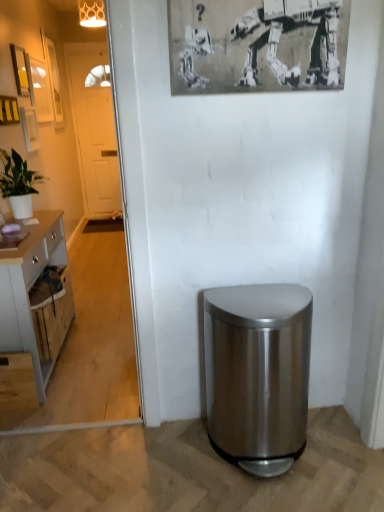
Question: Does wooden picture frame at upper left, positioned as the sixth picture frame in right-to-left order, have a larger size compared to matte white picture frame at upper left, the 3th picture frame from the right?

Choices:
 (A) yes
 (B) no

Answer: (A)

Question: Are wooden picture frame at upper left, marked as the 1th picture frame in a left-to-right arrangement, and matte white picture frame at upper left, positioned as the fourth picture frame in front-to-back order, far apart?

Choices:
 (A) yes
 (B) no

Answer: (A)

Question: Is wooden picture frame at upper left, which is the 6th picture frame from front to back, positioned in front of matte white picture frame at upper left, which is counted as the 3th picture frame, starting from the back?

Choices:
 (A) no
 (B) yes

Answer: (A)

Question: Does wooden picture frame at upper left, positioned as the sixth picture frame in right-to-left order, lie behind matte white picture frame at upper left, the 3th picture frame from the right?

Choices:
 (A) no
 (B) yes

Answer: (B)

Question: From a real-world perspective, does wooden picture frame at upper left, acting as the 1th picture frame starting from the back, stand above matte white picture frame at upper left, the 3th picture frame from the right?

Choices:
 (A) no
 (B) yes

Answer: (B)

Question: From a real-world perspective, relative to wooden picture frame at upper left, which is the 6th picture frame from front to back, is white wooden door at left vertically above or below?

Choices:
 (A) below
 (B) above

Answer: (A)

Question: From the image's perspective, is white wooden door at left positioned above or below wooden picture frame at upper left, marked as the 1th picture frame in a left-to-right arrangement?

Choices:
 (A) below
 (B) above

Answer: (A)

Question: Would you say white wooden door at left is to the left or to the right of wooden picture frame at upper left, acting as the 1th picture frame starting from the back, in the picture?

Choices:
 (A) right
 (B) left

Answer: (A)

Question: Is white wooden door at left taller or shorter than wooden picture frame at upper left, acting as the 1th picture frame starting from the back?

Choices:
 (A) short
 (B) tall

Answer: (B)

Question: In terms of size, does black and white paper at upper center, which is the sixth picture frame in back-to-front order, appear bigger or smaller than white wooden door at left?

Choices:
 (A) big
 (B) small

Answer: (B)

Question: From their relative heights in the image, would you say black and white paper at upper center, the 6th picture frame in the left-to-right sequence, is taller or shorter than white wooden door at left?

Choices:
 (A) tall
 (B) short

Answer: (B)

Question: From a real-world perspective, is black and white paper at upper center, the 6th picture frame in the left-to-right sequence, positioned above or below white wooden door at left?

Choices:
 (A) above
 (B) below

Answer: (A)

Question: In terms of width, does black and white paper at upper center, the 6th picture frame in the left-to-right sequence, look wider or thinner when compared to white wooden door at left?

Choices:
 (A) wide
 (B) thin

Answer: (B)

Question: From the image's perspective, is wooden picture frame at upper left, positioned as the sixth picture frame in right-to-left order, located above or below stainless steel trash can at lower right?

Choices:
 (A) below
 (B) above

Answer: (B)

Question: In the image, is wooden picture frame at upper left, marked as the 1th picture frame in a left-to-right arrangement, on the left side or the right side of stainless steel trash can at lower right?

Choices:
 (A) right
 (B) left

Answer: (B)